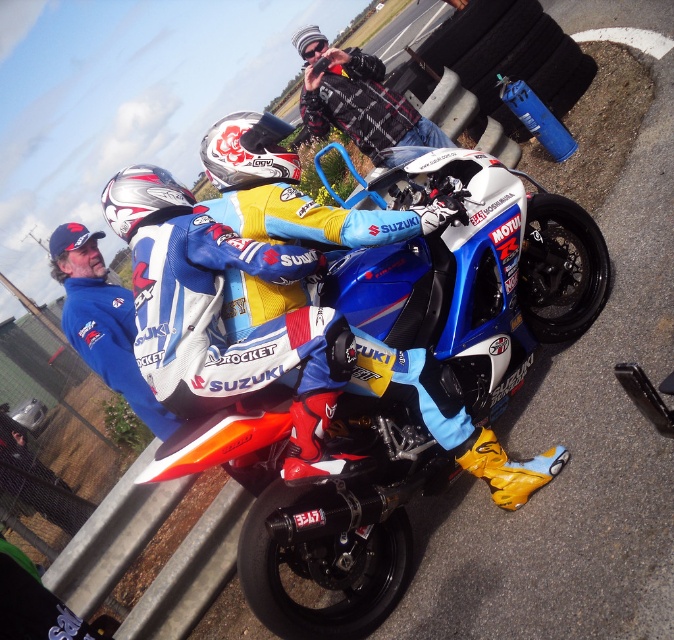
You are a photographer at the motorcycle event. You need to capture a photo where both the matte blue and white racing suit at center and the silver metallic helmet at upper left are visible. Which object should you adjust your camera angle to prioritize if the helmet is partially blocked?

The matte blue and white racing suit at center is taller than the silver metallic helmet at upper left, so you should prioritize adjusting your camera angle to ensure the helmet is fully visible since it is smaller in height.

You are a photographer at the motorcycle event. You want to take a photo of the white matte helmet at upper center and the silver metallic helmet at upper left. The minimum distance your camera can focus on two objects clearly is 12 inches. Can you capture both helmets in focus without moving the camera?

The white matte helmet at upper center is 12.28 inches away from the silver metallic helmet at upper left. Since the distance between them is slightly over 12 inches, the camera might struggle to keep both in focus. It would be better to move closer or adjust the focus settings.